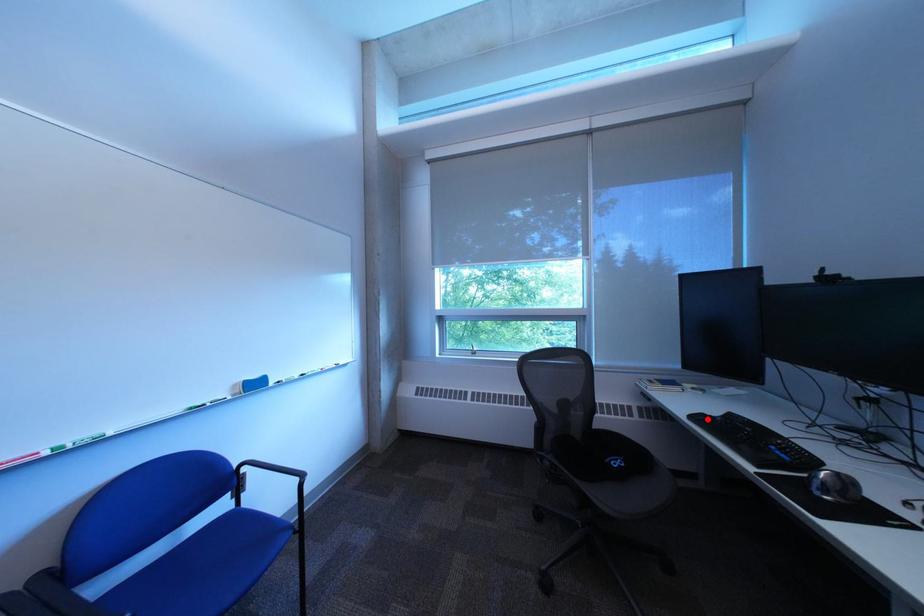
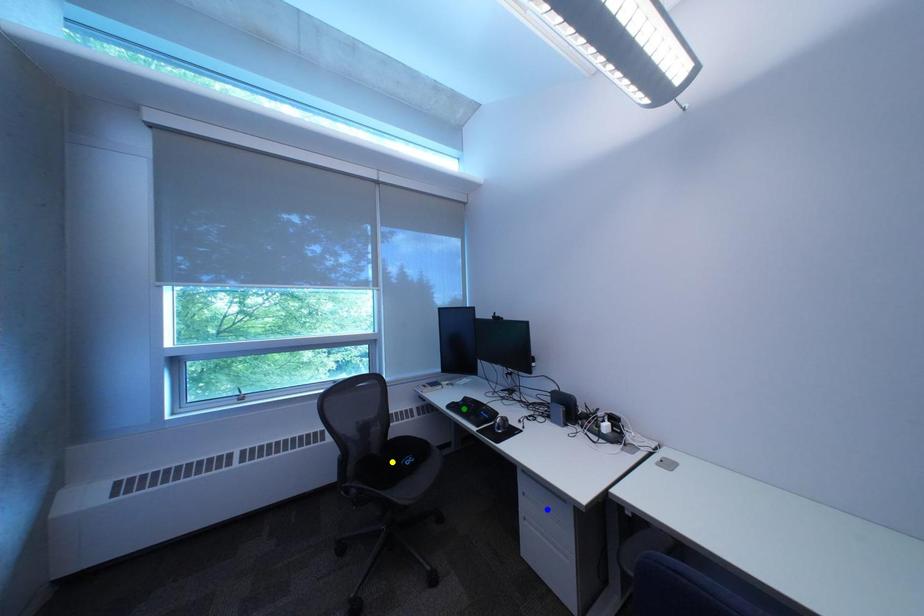
Question: I am providing you with two images of the same scene from different viewpoints. A red point is marked on the first image. You are given multiple points on the second image. In image 2, which mark is for the same physical point as the one in image 1?

Choices:
 (A) blue point
 (B) yellow point
 (C) green point

Answer: (C)